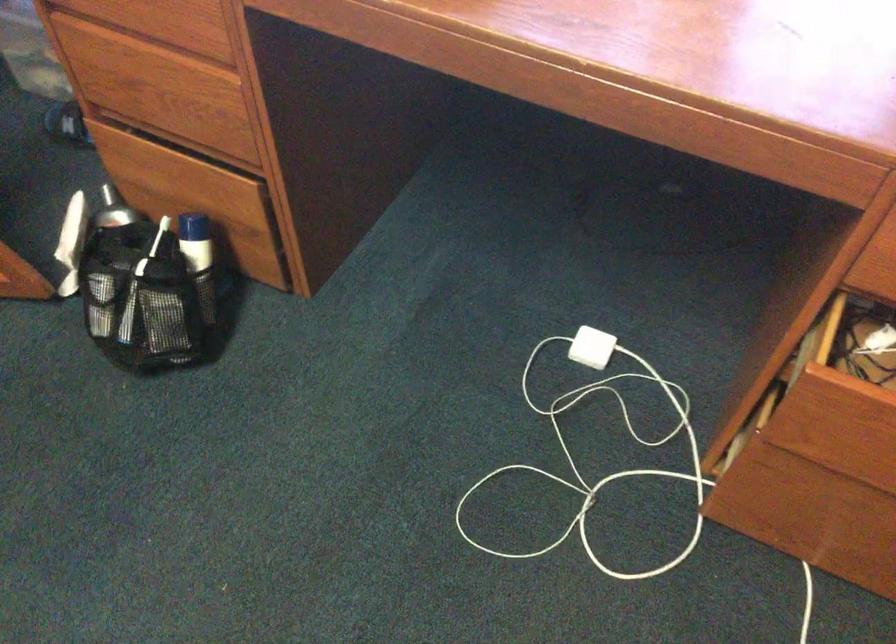
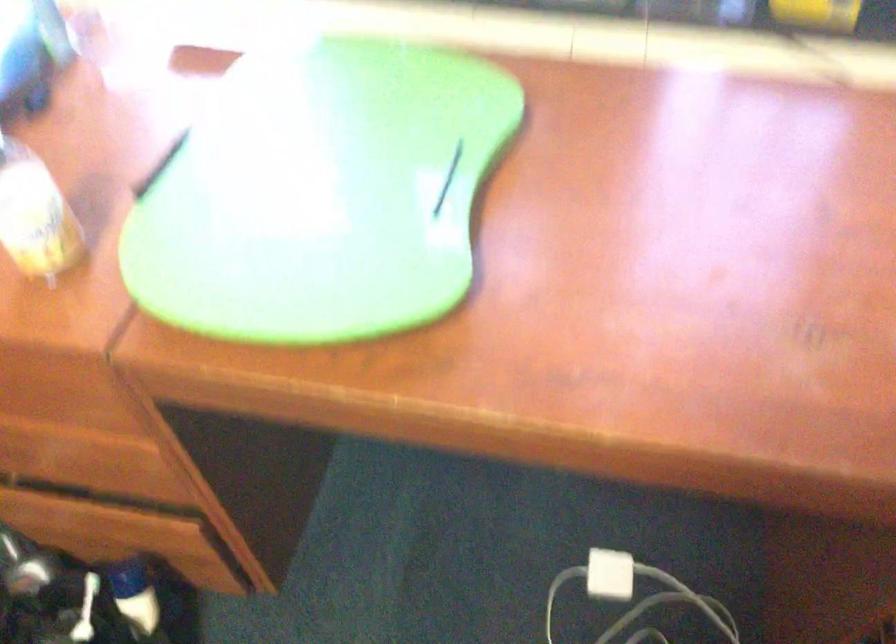
Question: What movement of the cameraman would produce the second image?

Choices:
 (A) Left
 (B) Right
 (C) Forward
 (D) Backward

Answer: (C)